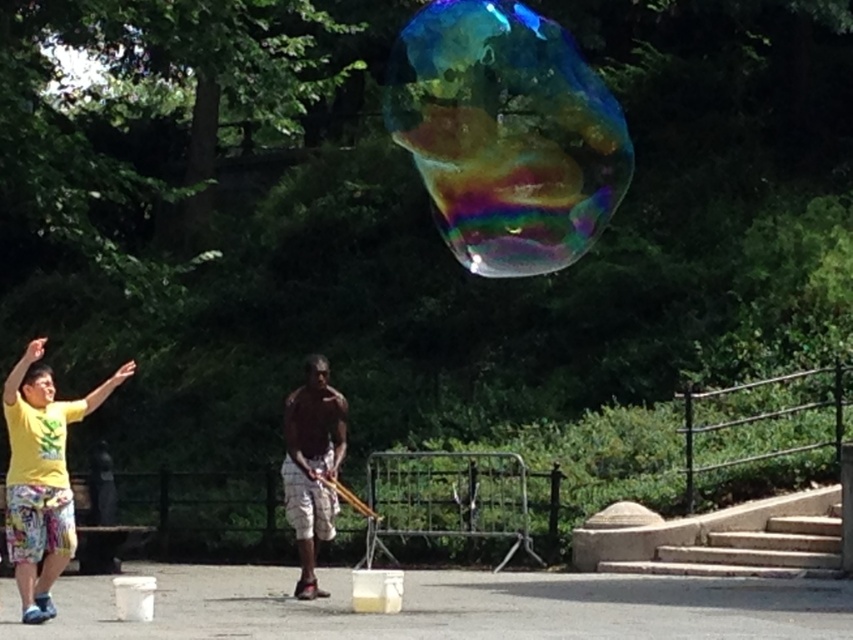
Between yellow cotton shirt at left and matte brown shorts at center, which one appears on the left side from the viewer's perspective?

Positioned to the left is yellow cotton shirt at left.

Is point (119, 365) farther from camera compared to point (343, 432)?

That is True.

Who is more forward, (x=26, y=417) or (x=310, y=502)?

Point (x=26, y=417)

Identify the location of yellow cotton shirt at left. This screenshot has width=853, height=640. click(41, 476).

Does rainbow iridescent bubble at upper center have a lesser width compared to yellow cotton shirt at left?

Indeed, rainbow iridescent bubble at upper center has a lesser width compared to yellow cotton shirt at left.

Can you confirm if rainbow iridescent bubble at upper center is shorter than yellow cotton shirt at left?

Yes, rainbow iridescent bubble at upper center is shorter than yellow cotton shirt at left.

Does point (488, 152) come closer to viewer compared to point (51, 552)?

No.

Image resolution: width=853 pixels, height=640 pixels. I want to click on rainbow iridescent bubble at upper center, so click(506, 134).

Can you confirm if rainbow iridescent bubble at upper center is positioned above matte brown shorts at center?

Correct, rainbow iridescent bubble at upper center is located above matte brown shorts at center.

Is point (585, 232) closer to camera compared to point (329, 524)?

No.

Between point (561, 124) and point (293, 515), which one is positioned in front?

Point (293, 515) is more forward.

The width and height of the screenshot is (853, 640). Find the location of `rainbow iridescent bubble at upper center`. rainbow iridescent bubble at upper center is located at coordinates (506, 134).